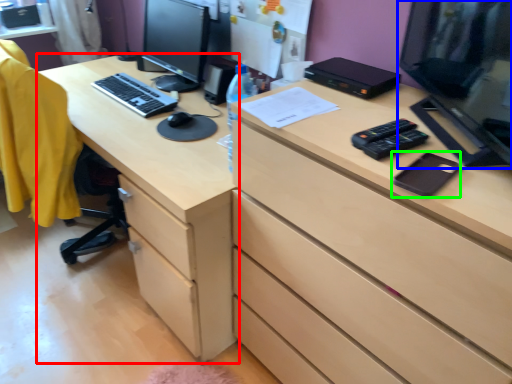
Question: Which object is the closest to the desk (highlighted by a red box)? Choose among these: computer monitor (highlighted by a blue box) or notepad (highlighted by a green box).

Choices:
 (A) computer monitor
 (B) notepad

Answer: (A)